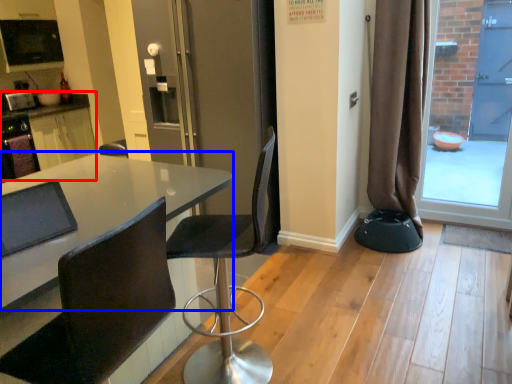
Question: Which object is closer to the camera taking this photo, computer desk (highlighted by a red box) or table (highlighted by a blue box)?

Choices:
 (A) computer desk
 (B) table

Answer: (B)